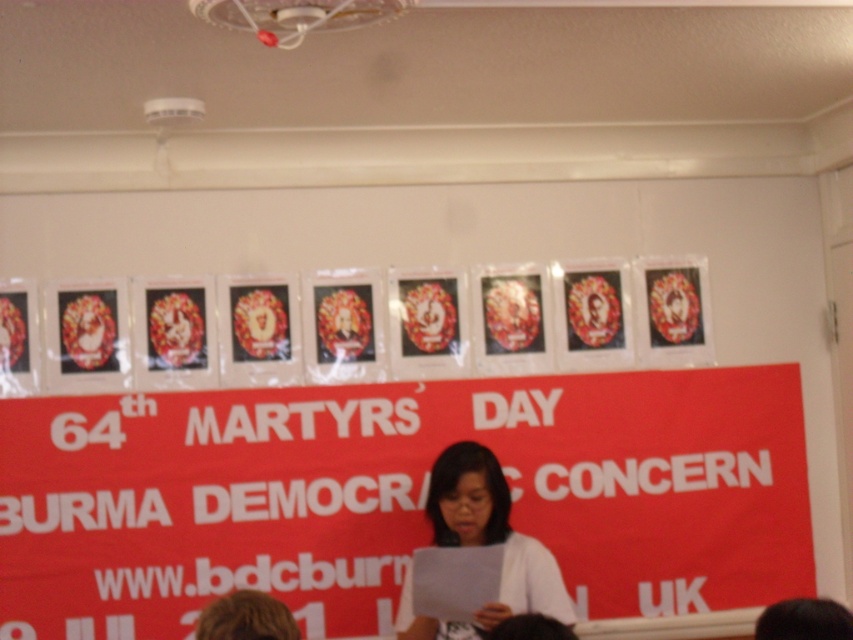
Which is in front, point (235, 508) or point (511, 561)?

Point (511, 561) is more forward.

Which is above, red matte poster at center or white paper at center?

red matte poster at center

Does point (325, 532) lie in front of point (431, 492)?

No, (325, 532) is behind (431, 492).

Locate an element on the screen. red matte poster at center is located at coordinates (397, 496).